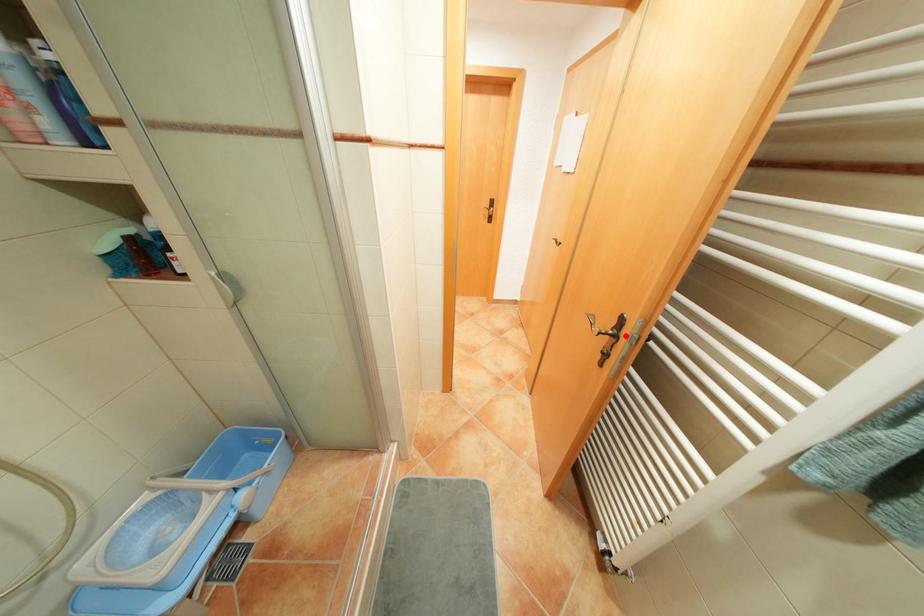
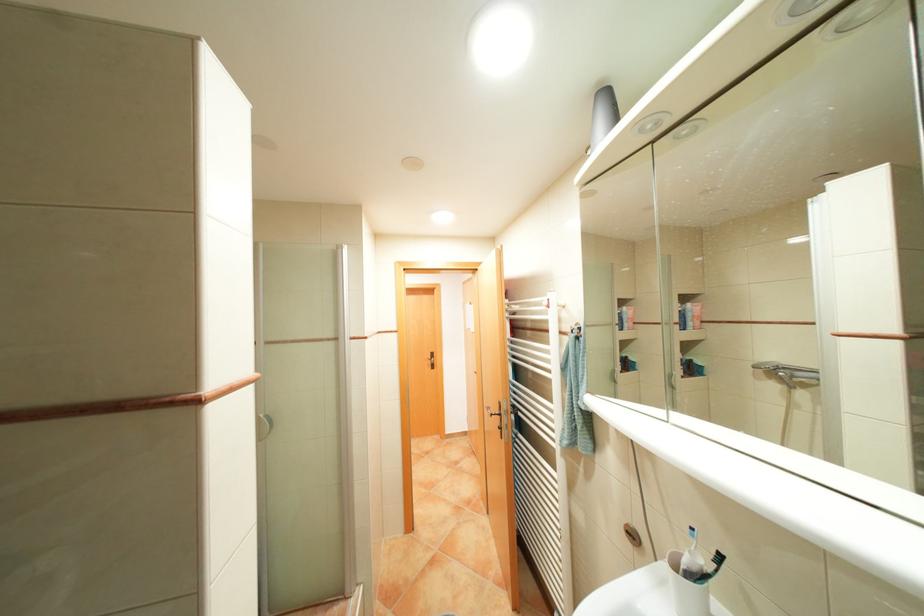
The point at the highlighted location is marked in the first image. Where is the corresponding point in the second image?

(509, 413)